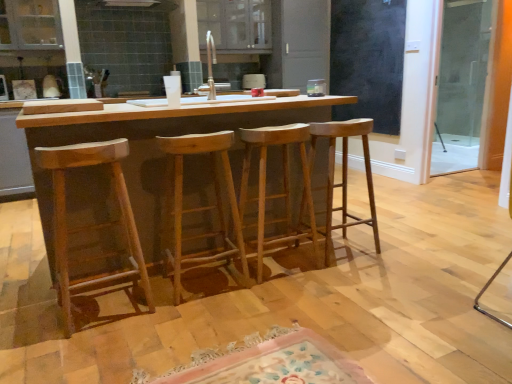
Where is `blank area beneath natural wood stool at center, the 1th stool viewed from the right (from a real-world perspective)`? Image resolution: width=512 pixels, height=384 pixels. blank area beneath natural wood stool at center, the 1th stool viewed from the right (from a real-world perspective) is located at coordinates (344, 252).